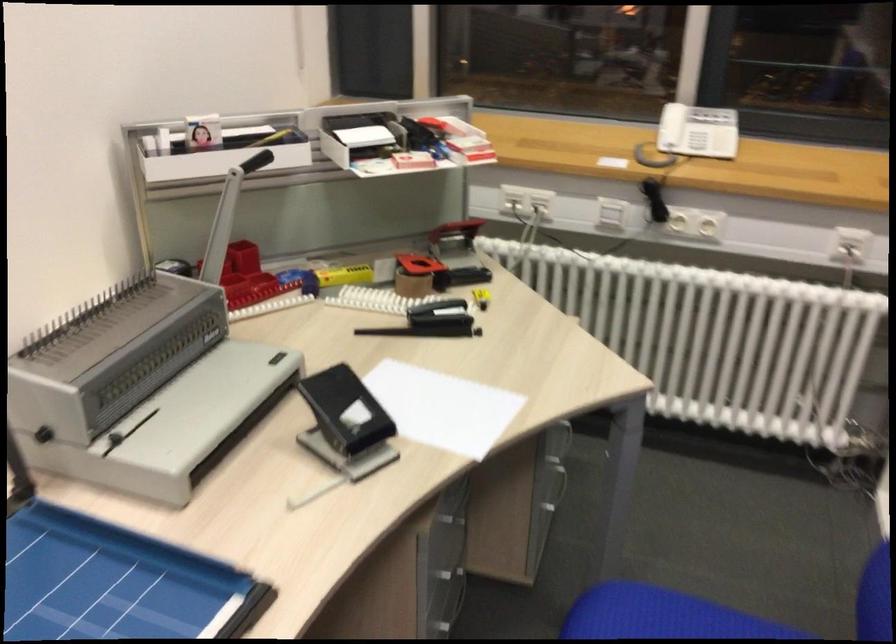
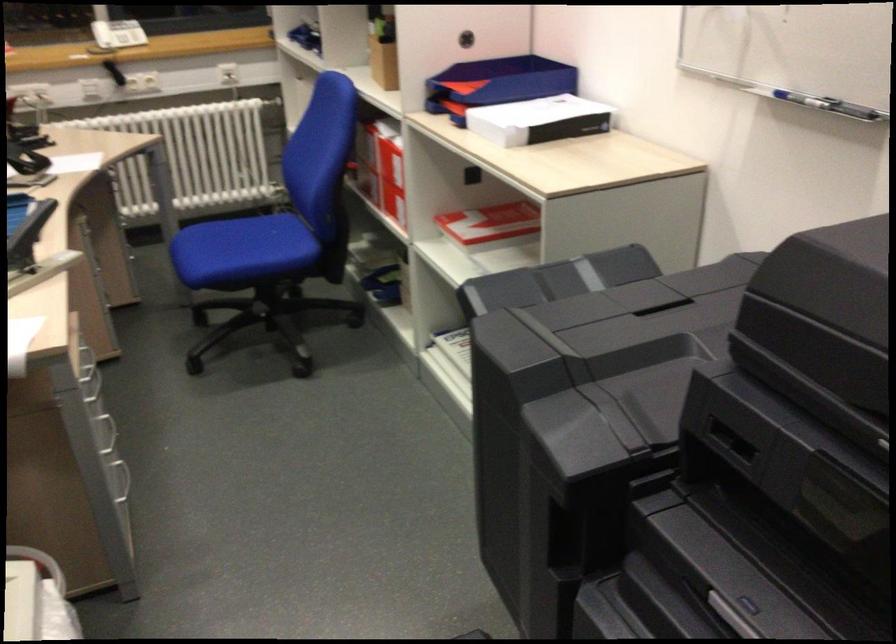
Where in the second image is the point corresponding to point (688, 126) from the first image?

(117, 33)